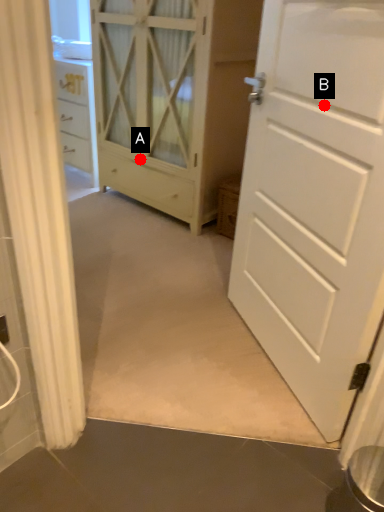
Question: Two points are circled on the image, labeled by A and B beside each circle. Which point appears closest to the camera in this image?

Choices:
 (A) A is closer
 (B) B is closer

Answer: (B)